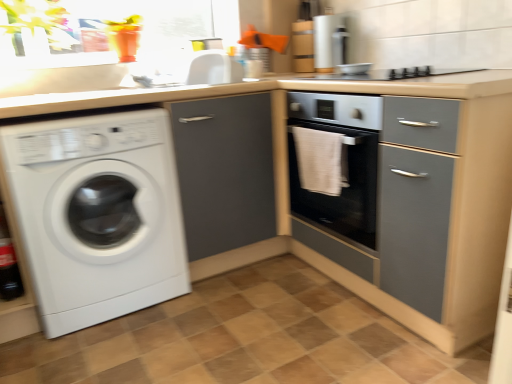
Locate an element on the screen. This screenshot has width=512, height=384. white towel at center is located at coordinates (321, 160).

From a real-world perspective, relative to white towel at center, is metallic silver bowl at upper center vertically above or below?

metallic silver bowl at upper center is above white towel at center.

Looking at this image, which point is more distant from viewer, (x=354, y=68) or (x=323, y=162)?

Positioned behind is point (x=354, y=68).

Would you say white towel at center is part of metallic silver bowl at upper center's contents?

That's incorrect, white towel at center is not inside metallic silver bowl at upper center.

Which object is wider, metallic silver bowl at upper center or white towel at center?

metallic silver bowl at upper center is wider.

Can you confirm if matte gray cabinet at center is wider than white towel at center?

Correct, the width of matte gray cabinet at center exceeds that of white towel at center.

Which is more distant, (x=175, y=144) or (x=345, y=171)?

Positioned behind is point (x=175, y=144).

In the image, is matte gray cabinet at center positioned in front of or behind white towel at center?

Visually, matte gray cabinet at center is located behind white towel at center.

Consider the image. Would you consider matte gray cabinet at center to be distant from white towel at center?

matte gray cabinet at center is actually quite close to white towel at center.

From the image's perspective, is white glossy washing machine at left above or below matte gray cabinet at center?

white glossy washing machine at left is below matte gray cabinet at center.

Considering the relative positions of white glossy washing machine at left and matte gray cabinet at center in the image provided, is white glossy washing machine at left to the left or to the right of matte gray cabinet at center?

In the image, white glossy washing machine at left appears on the left side of matte gray cabinet at center.

Considering the relative sizes of white glossy washing machine at left and matte gray cabinet at center in the image provided, is white glossy washing machine at left taller than matte gray cabinet at center?

No, white glossy washing machine at left is not taller than matte gray cabinet at center.

Considering the positions of points (88, 308) and (359, 65), is point (88, 308) closer to camera compared to point (359, 65)?

Yes, it is.

Is white glossy washing machine at left to the left or to the right of metallic silver bowl at upper center in the image?

white glossy washing machine at left is to the left of metallic silver bowl at upper center.

Could you tell me if white glossy washing machine at left is facing metallic silver bowl at upper center?

No, white glossy washing machine at left is not turned towards metallic silver bowl at upper center.

Image resolution: width=512 pixels, height=384 pixels. What are the coordinates of `sink that is on the left side of white towel at center` in the screenshot? It's located at (191, 70).

Can we say white towel at center lies outside white glossy sink at upper center?

white towel at center is positioned outside white glossy sink at upper center.

Who is smaller, white towel at center or white glossy sink at upper center?

Smaller between the two is white towel at center.

From the picture: Between white towel at center and white glossy sink at upper center, which one has less height?

With less height is white glossy sink at upper center.

Is white glossy sink at upper center positioned with its back to metallic silver bowl at upper center?

white glossy sink at upper center is not turned away from metallic silver bowl at upper center.

Does white glossy sink at upper center have a lesser width compared to metallic silver bowl at upper center?

In fact, white glossy sink at upper center might be wider than metallic silver bowl at upper center.

From a real-world perspective, is white glossy sink at upper center physically located above or below metallic silver bowl at upper center?

In terms of real-world spatial position, white glossy sink at upper center is above metallic silver bowl at upper center.

From the image's perspective, does white glossy sink at upper center appear higher than metallic silver bowl at upper center?

Yes.

Is metallic silver bowl at upper center looking in the opposite direction of white glossy washing machine at left?

No, metallic silver bowl at upper center is not facing the opposite direction of white glossy washing machine at left.

Considering the sizes of objects metallic silver bowl at upper center and white glossy washing machine at left in the image provided, who is smaller, metallic silver bowl at upper center or white glossy washing machine at left?

metallic silver bowl at upper center is smaller.

Would you consider metallic silver bowl at upper center to be distant from white glossy washing machine at left?

Indeed, metallic silver bowl at upper center is not near white glossy washing machine at left.

You are a GUI agent. You are given a task and a screenshot of the screen. Output one action in this format:
    pyautogui.click(x=<x>, y=<y>)
    Task: Click on the appliance behind the white towel at center
    
    Given the screenshot: What is the action you would take?
    pyautogui.click(x=354, y=69)

Where is `file cabinet lying on the left of white towel at center`? The image size is (512, 384). file cabinet lying on the left of white towel at center is located at coordinates (224, 171).

Consider the image. Considering their positions, is white glossy sink at upper center positioned further to white towel at center than metallic silver bowl at upper center?

white glossy sink at upper center is further to white towel at center.

Looking at the image, which one is located further to white glossy sink at upper center, metallic silver bowl at upper center or white towel at center?

metallic silver bowl at upper center lies further to white glossy sink at upper center than the other object.

Considering their positions, is metallic silver bowl at upper center positioned further to white towel at center than white glossy sink at upper center?

white glossy sink at upper center lies further to white towel at center than the other object.

Based on their spatial positions, is metallic silver bowl at upper center or white towel at center closer to white glossy washing machine at left?

white towel at center is closer to white glossy washing machine at left.

Based on their spatial positions, is white glossy sink at upper center or white towel at center further from white glossy washing machine at left?

Based on the image, white towel at center appears to be further to white glossy washing machine at left.

From the image, which object appears to be farther from matte gray cabinet at center, white glossy sink at upper center or metallic silver bowl at upper center?

metallic silver bowl at upper center.

Considering their positions, is metallic silver bowl at upper center positioned further to white towel at center than matte gray cabinet at center?

metallic silver bowl at upper center lies further to white towel at center than the other object.

Which object lies nearer to the anchor point white towel at center, matte gray cabinet at center or white glossy sink at upper center?

Based on the image, matte gray cabinet at center appears to be nearer to white towel at center.

Locate an element on the screen. material located between white glossy sink at upper center and metallic silver bowl at upper center in the left-right direction is located at coordinates (321, 160).

At what (x,y) coordinates should I click in order to perform the action: click on material that lies between white glossy sink at upper center and matte gray cabinet at center from top to bottom. Please return your answer as a coordinate pair (x, y). Image resolution: width=512 pixels, height=384 pixels. Looking at the image, I should click on (321, 160).

Where is `sink between white glossy washing machine at left and white towel at center in the horizontal direction`? sink between white glossy washing machine at left and white towel at center in the horizontal direction is located at coordinates (191, 70).

I want to click on sink between white glossy washing machine at left and metallic silver bowl at upper center, so click(191, 70).